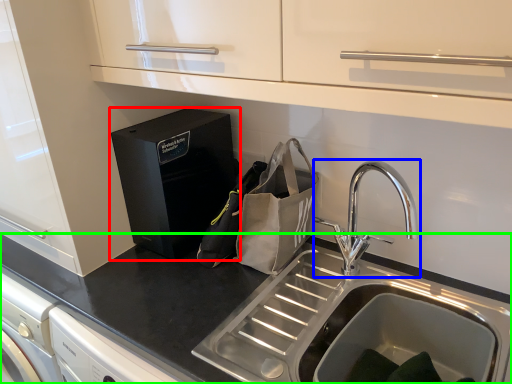
Question: Which object is positioned closest to home appliance (highlighted by a red box)? Select from tap (highlighted by a blue box) and countertop (highlighted by a green box).

Choices:
 (A) tap
 (B) countertop

Answer: (B)